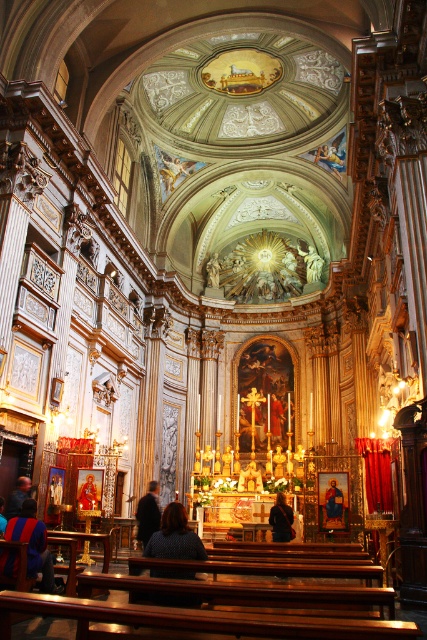
From the picture: Is dark blue sweater at lower left smaller than dark brown leather coat at center?

Incorrect, dark blue sweater at lower left is not smaller in size than dark brown leather coat at center.

This screenshot has width=427, height=640. Describe the element at coordinates (34, 545) in the screenshot. I see `dark blue sweater at lower left` at that location.

Who is more distant from viewer, (58, 584) or (149, 515)?

The point (149, 515) is more distant.

Where is `dark blue sweater at lower left`? The height and width of the screenshot is (640, 427). dark blue sweater at lower left is located at coordinates (34, 545).

Between dark brown leather coat at center and matte gold icon at center, which one appears on the right side from the viewer's perspective?

From the viewer's perspective, matte gold icon at center appears more on the right side.

Between point (158, 515) and point (327, 506), which one is positioned in front?

Point (327, 506)

In order to click on dark brown leather coat at center in this screenshot , I will do `click(148, 513)`.

Can you confirm if dark blue textured sweater at center is smaller than dark brown leather jacket at center?

Correct, dark blue textured sweater at center occupies less space than dark brown leather jacket at center.

Which is behind, point (181, 545) or point (284, 541)?

Point (284, 541)

Which is behind, point (173, 576) or point (275, 531)?

Positioned behind is point (275, 531).

Locate an element on the screen. The width and height of the screenshot is (427, 640). dark blue textured sweater at center is located at coordinates (175, 536).